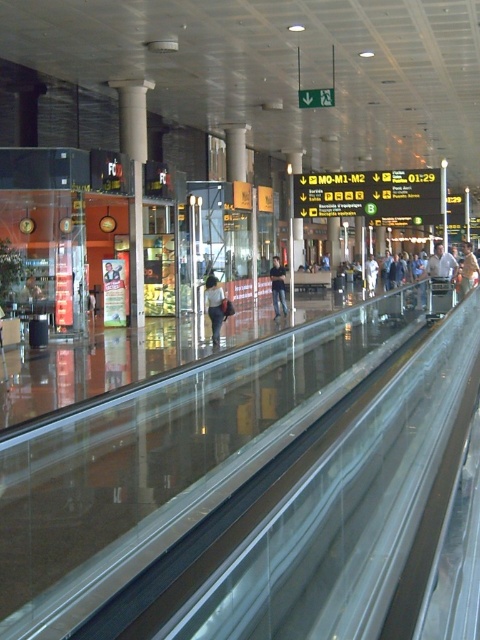
You are a traveler standing in the transportation hub and see both the light blue denim jeans at center and the light brown leather jacket at center. Which item is positioned higher relative to the other?

The light brown leather jacket at center is positioned higher than the light blue denim jeans at center.

You are a traveler carrying a heavy suitcase and need to place your jeans on a bench near the light blue denim jeans at center and dark blue jeans at center. Which jeans should you place your suitcase next to to avoid blocking the walkway?

You should place your suitcase next to the dark blue jeans at center because the light blue denim jeans at center is positioned under it, meaning the dark blue jeans is closer to the walkway and less likely to block it when placing the suitcase nearby.